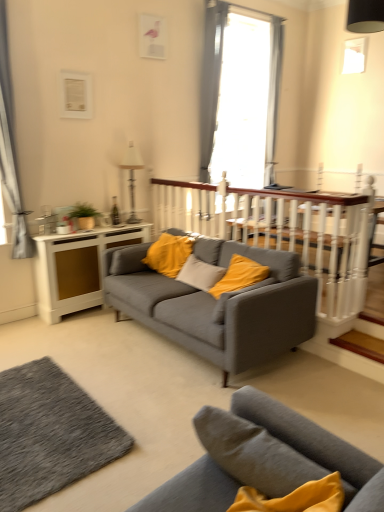
At what (x,y) coordinates should I click in order to perform the action: click on free space in front of white wood side table at left. Please return your answer as a coordinate pair (x, y). Looking at the image, I should click on (90, 332).